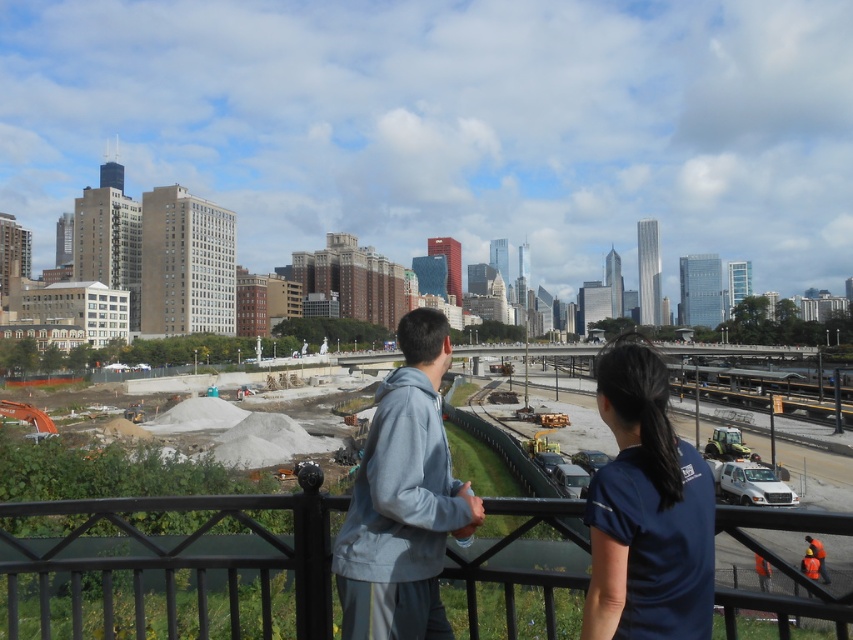
You are a delivery robot with a width of 1.5 meters. You need to pass between the gray fleece jacket at center and the light gray hoodie at center. Is there enough space for you to navigate through?

The distance between the gray fleece jacket at center and the light gray hoodie at center is 2.16 meters. Since your width is 1.5 meters, there is sufficient space to navigate through as the gap is wider than your robot.

You are standing on the bridge and want to reach the construction site. The point at coordinates (x=223, y=580) is part of the path. Is this point within a safe distance for you to walk towards the construction site?

The point at coordinates (x=223, y=580) is 181.27 feet from the viewer. Since it is part of the path towards the construction site, it is within a safe distance to walk towards the site.

You are a city planner assessing safety on the bridge. The safety guidelines require that the railing must be at least twice as wide as any person standing near it. Given the black metal railing at center and dark blue shirt at center, can the current railing meet the safety standards?

The black metal railing at center has a larger size compared to dark blue shirt at center. Since the railing is larger, it likely meets the requirement of being at least twice as wide as the person wearing the dark blue shirt at center.